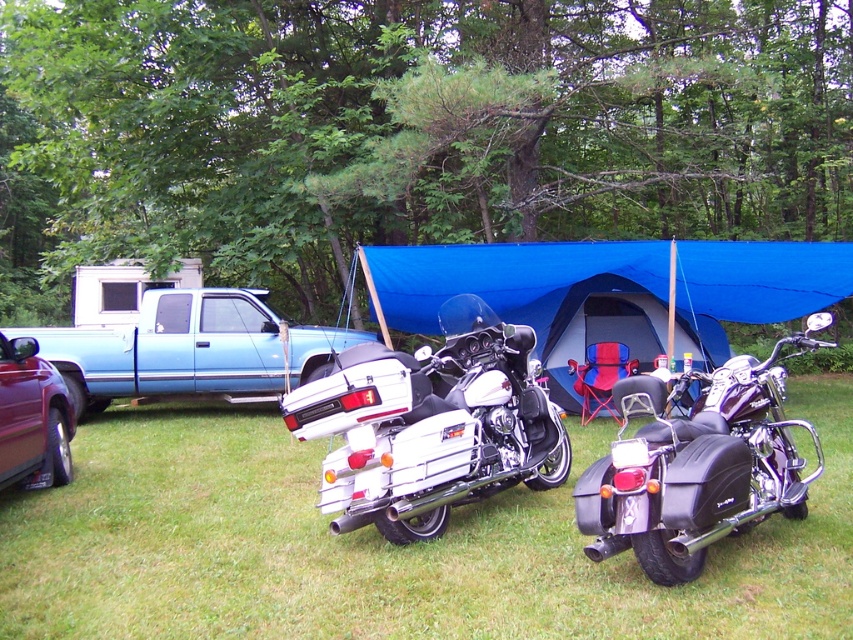
Is green grass at center to the right of blue fabric tent at center from the viewer's perspective?

No, green grass at center is not to the right of blue fabric tent at center.

Can you confirm if green grass at center is smaller than blue fabric tent at center?

No, green grass at center is not smaller than blue fabric tent at center.

Image resolution: width=853 pixels, height=640 pixels. I want to click on green grass at center, so click(x=384, y=547).

Where is `green grass at center`? The height and width of the screenshot is (640, 853). green grass at center is located at coordinates [x=384, y=547].

Who is more distant from viewer, (485, 348) or (0, 417)?

Point (485, 348)

Can you confirm if white metallic motorcycle at center is positioned to the left of metallic maroon car at lower left?

Incorrect, white metallic motorcycle at center is not on the left side of metallic maroon car at lower left.

Between point (364, 365) and point (10, 461), which one is positioned behind?

The point (10, 461) is behind.

At what (x,y) coordinates should I click in order to perform the action: click on white metallic motorcycle at center. Please return your answer as a coordinate pair (x, y). Image resolution: width=853 pixels, height=640 pixels. Looking at the image, I should click on (431, 426).

Can you confirm if white metallic motorcycle at center is taller than black matte motorcycle at lower right?

Yes.

Is white metallic motorcycle at center to the right of black matte motorcycle at lower right from the viewer's perspective?

In fact, white metallic motorcycle at center is to the left of black matte motorcycle at lower right.

The height and width of the screenshot is (640, 853). Identify the location of white metallic motorcycle at center. (431, 426).

Image resolution: width=853 pixels, height=640 pixels. Find the location of `white metallic motorcycle at center`. white metallic motorcycle at center is located at coordinates (431, 426).